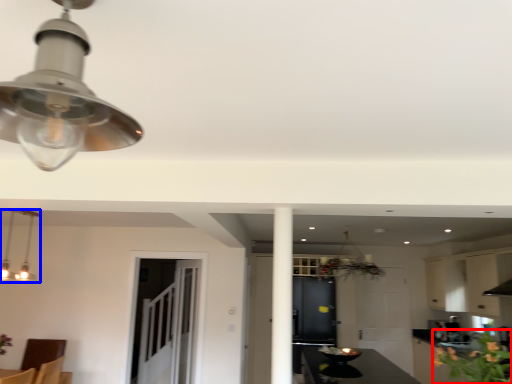
Question: Which object appears closest to the camera in this image, flower (highlighted by a red box) or lamp (highlighted by a blue box)?

Choices:
 (A) flower
 (B) lamp

Answer: (A)